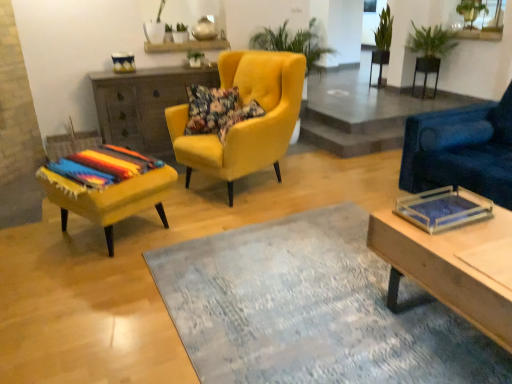
Question: From a real-world perspective, is black metal side table at upper right positioned under green leafy plant at upper right, arranged as the 3th plant when viewed from the right, based on gravity?

Choices:
 (A) yes
 (B) no

Answer: (A)

Question: From the image's perspective, does black metal side table at upper right appear lower than green leafy plant at upper right, the 1th plant from the left?

Choices:
 (A) yes
 (B) no

Answer: (A)

Question: Is the depth of black metal side table at upper right less than that of green leafy plant at upper right, arranged as the 3th plant when viewed from the right?

Choices:
 (A) yes
 (B) no

Answer: (A)

Question: From the image's perspective, is black metal side table at upper right above green leafy plant at upper right, the 1th plant from the left?

Choices:
 (A) yes
 (B) no

Answer: (B)

Question: Does black metal side table at upper right have a greater width compared to green leafy plant at upper right, arranged as the 3th plant when viewed from the right?

Choices:
 (A) no
 (B) yes

Answer: (A)

Question: Considering the positions of velvet yellow armchair at center, placed as the second chair when sorted from left to right, and green leafy plant at upper right, the 1th plant when ordered from right to left, in the image, is velvet yellow armchair at center, placed as the second chair when sorted from left to right, bigger or smaller than green leafy plant at upper right, the 1th plant when ordered from right to left,?

Choices:
 (A) big
 (B) small

Answer: (A)

Question: From the image's perspective, relative to green leafy plant at upper right, the 1th plant when ordered from right to left, is velvet yellow armchair at center, the 2th chair from the right, above or below?

Choices:
 (A) below
 (B) above

Answer: (A)

Question: From a real-world perspective, is velvet yellow armchair at center, the 2th chair from the right, positioned above or below green leafy plant at upper right, acting as the 3th plant starting from the left?

Choices:
 (A) below
 (B) above

Answer: (A)

Question: Considering the positions of velvet yellow armchair at center, the 2th chair from the right, and green leafy plant at upper right, acting as the 3th plant starting from the left, in the image, is velvet yellow armchair at center, the 2th chair from the right, taller or shorter than green leafy plant at upper right, acting as the 3th plant starting from the left,?

Choices:
 (A) tall
 (B) short

Answer: (A)

Question: Looking at the image, does green leafy plant at upper right, which appears as the second plant when viewed from the right, seem bigger or smaller compared to wooden rectangular tray at right?

Choices:
 (A) small
 (B) big

Answer: (A)

Question: Is green leafy plant at upper right, arranged as the 2th plant when viewed from the left, inside the boundaries of wooden rectangular tray at right, or outside?

Choices:
 (A) inside
 (B) outside

Answer: (B)

Question: Considering the relative positions of green leafy plant at upper right, which appears as the second plant when viewed from the right, and wooden rectangular tray at right in the image provided, is green leafy plant at upper right, which appears as the second plant when viewed from the right, to the left or to the right of wooden rectangular tray at right?

Choices:
 (A) left
 (B) right

Answer: (B)

Question: Looking at their shapes, would you say green leafy plant at upper right, which appears as the second plant when viewed from the right, is wider or thinner than wooden rectangular tray at right?

Choices:
 (A) thin
 (B) wide

Answer: (A)

Question: From the image's perspective, is green leafy plant at upper right, arranged as the 3th plant when viewed from the right, positioned above or below matte yellow ottoman at left, which ranks as the first chair in left-to-right order?

Choices:
 (A) below
 (B) above

Answer: (B)

Question: Visually, is green leafy plant at upper right, the 1th plant from the left, positioned to the left or to the right of matte yellow ottoman at left, the third chair from the right?

Choices:
 (A) left
 (B) right

Answer: (B)